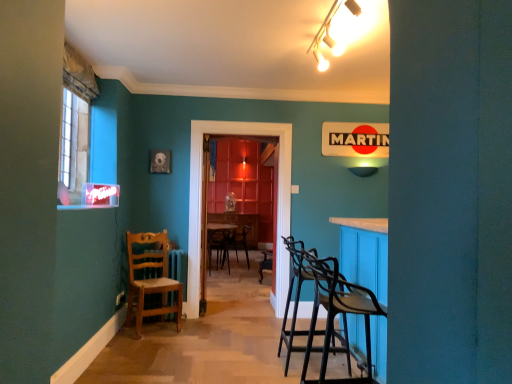
Question: Looking at their shapes, would you say wooden chair at left is wider or thinner than translucent wooden door at center?

Choices:
 (A) wide
 (B) thin

Answer: (A)

Question: Considering the relative positions of wooden chair at left and translucent wooden door at center in the image provided, is wooden chair at left to the left or to the right of translucent wooden door at center?

Choices:
 (A) left
 (B) right

Answer: (A)

Question: Which object is positioned closest to the wooden picture frame at upper left?

Choices:
 (A) wooden chair at left
 (B) matte plastic power outlet at lower left
 (C) white glossy track light at upper center
 (D) translucent wooden door at center
 (E) matte white lampshade at upper right

Answer: (D)

Question: Which is farther from the matte white lampshade at upper right?

Choices:
 (A) white glossy track light at upper center
 (B) wooden chair at left
 (C) translucent wooden door at center
 (D) wooden picture frame at upper left
 (E) matte plastic power outlet at lower left

Answer: (E)